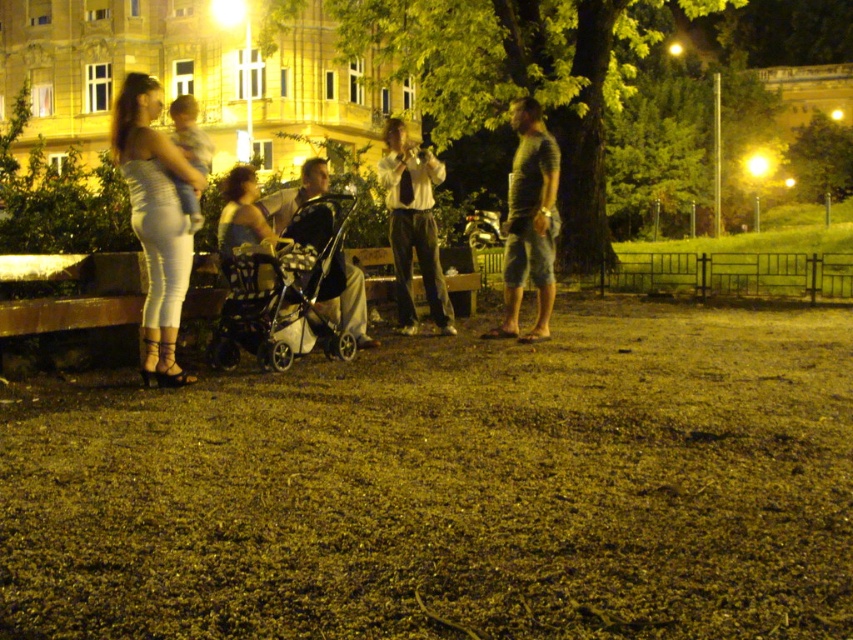
You are a photographer trying to capture a candid shot of the white shirt at center without the matte black stroller at center blocking the view. Is this possible based on their positions?

The matte black stroller at center is closer to the viewer than the white shirt at center, so the stroller would block the direct line of sight to the white shirt at center. Therefore, capturing a clear shot without obstruction might not be possible unless you move to a different angle or position.